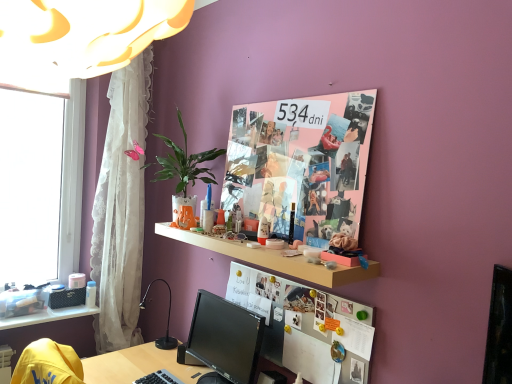
Where is `free point above wooden shelf at center, marked as the 2th shelf in a left-to-right arrangement (from a real-world perspective)`? Image resolution: width=512 pixels, height=384 pixels. free point above wooden shelf at center, marked as the 2th shelf in a left-to-right arrangement (from a real-world perspective) is located at coordinates (254, 240).